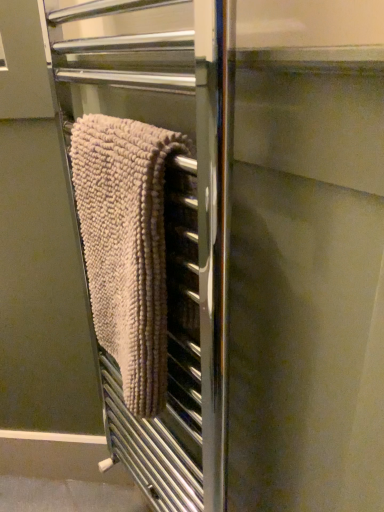
This screenshot has height=512, width=384. Find the location of `beige textured towel at center`. beige textured towel at center is located at coordinates (126, 246).

The width and height of the screenshot is (384, 512). Describe the element at coordinates (126, 246) in the screenshot. I see `beige textured towel at center` at that location.

Find the location of a particular element. This screenshot has width=384, height=512. beige textured towel at center is located at coordinates (126, 246).